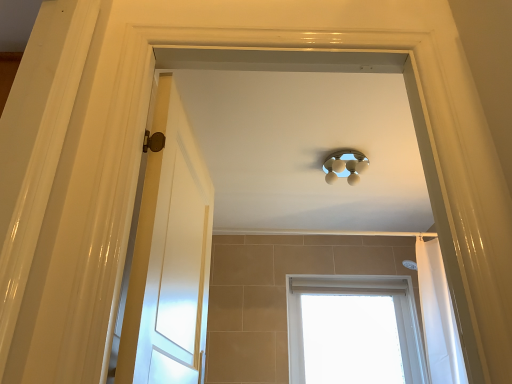
What do you see at coordinates (170, 256) in the screenshot? Image resolution: width=512 pixels, height=384 pixels. I see `white wooden door at left` at bounding box center [170, 256].

You are a GUI agent. You are given a task and a screenshot of the screen. Output one action in this format:
    pyautogui.click(x=<x>, y=<y>)
    Task: Click on the white wooden door at left
    Image resolution: width=512 pixels, height=384 pixels.
    Given the screenshot: What is the action you would take?
    pyautogui.click(x=170, y=256)

Where is `satin silver light fixture at center`? This screenshot has height=384, width=512. satin silver light fixture at center is located at coordinates (345, 165).

Identify the location of white plastic window at lower center. (357, 293).

Which is behind, point (434, 342) or point (291, 279)?

Point (291, 279)

Which of these two, white fabric shower curtain at right or white plastic window at lower center, stands taller?

With more height is white fabric shower curtain at right.

The height and width of the screenshot is (384, 512). Identify the location of shower curtain above the white plastic window at lower center (from a real-world perspective). (438, 316).

Between white fabric shower curtain at right and white plastic window at lower center, which one has smaller size?

Smaller between the two is white fabric shower curtain at right.

Between white fabric shower curtain at right and white wooden door at left, which one has larger size?

Bigger between the two is white fabric shower curtain at right.

Can you confirm if white fabric shower curtain at right is shorter than white wooden door at left?

In fact, white fabric shower curtain at right may be taller than white wooden door at left.

From the image's perspective, is white fabric shower curtain at right located above white wooden door at left?

No.

Locate an element on the screen. This screenshot has height=384, width=512. door that appears in front of the white fabric shower curtain at right is located at coordinates (170, 256).

Considering their positions, is white plastic window at lower center located in front of or behind satin silver light fixture at center?

Visually, white plastic window at lower center is located behind satin silver light fixture at center.

Is white plastic window at lower center positioned with its back to satin silver light fixture at center?

white plastic window at lower center does not have its back to satin silver light fixture at center.

In the scene shown: Is white plastic window at lower center completely or partially outside of satin silver light fixture at center?

white plastic window at lower center lies outside satin silver light fixture at center's area.

From a real-world perspective, is white plastic window at lower center physically above satin silver light fixture at center?

No, from a real-world perspective, white plastic window at lower center is not on top of satin silver light fixture at center.

Is satin silver light fixture at center wider than white wooden door at left?

Yes, satin silver light fixture at center is wider than white wooden door at left.

Between point (336, 159) and point (191, 199), which one is positioned in front?

The point (191, 199) is in front.

Is satin silver light fixture at center inside or outside of white wooden door at left?

The correct answer is: outside.

How many degrees apart are the facing directions of white wooden door at left and satin silver light fixture at center?

The angle between the facing direction of white wooden door at left and the facing direction of satin silver light fixture at center is 84.9 degrees.

Is white wooden door at left facing towards satin silver light fixture at center?

No.

From a real-world perspective, which object rests below the other?

white wooden door at left is physically lower.

Which is behind, point (189, 258) or point (344, 173)?

The point (344, 173) is behind.

From the picture: Is satin silver light fixture at center oriented towards white plastic window at lower center?

No, satin silver light fixture at center is not turned towards white plastic window at lower center.

Which object is positioned more to the left, satin silver light fixture at center or white plastic window at lower center?

Positioned to the left is satin silver light fixture at center.

From a real-world perspective, who is located higher, satin silver light fixture at center or white plastic window at lower center?

From a 3D spatial view, satin silver light fixture at center is above.

Is point (364, 170) behind point (433, 378)?

Yes, it is behind point (433, 378).

Does satin silver light fixture at center have a lesser height compared to white fabric shower curtain at right?

Yes.

From the image's perspective, is satin silver light fixture at center above or below white fabric shower curtain at right?

Based on their image positions, satin silver light fixture at center is located above white fabric shower curtain at right.

I want to click on window on the left of white fabric shower curtain at right, so click(357, 293).

Where is `shower curtain on the right of the white wooden door at left`? The height and width of the screenshot is (384, 512). shower curtain on the right of the white wooden door at left is located at coordinates (438, 316).

From the image, which object appears to be nearer to white wooden door at left, white plastic window at lower center or white fabric shower curtain at right?

The object closer to white wooden door at left is white fabric shower curtain at right.

Estimate the real-world distances between objects in this image. Which object is further from white fabric shower curtain at right, white wooden door at left or white plastic window at lower center?

white wooden door at left.

Considering their positions, is white fabric shower curtain at right positioned closer to satin silver light fixture at center than white plastic window at lower center?

white fabric shower curtain at right is closer to satin silver light fixture at center.

From the image, which object appears to be nearer to satin silver light fixture at center, white plastic window at lower center or white fabric shower curtain at right?

white fabric shower curtain at right is positioned closer to the anchor satin silver light fixture at center.

Based on their spatial positions, is white wooden door at left or satin silver light fixture at center closer to white plastic window at lower center?

→ satin silver light fixture at center is positioned closer to the anchor white plastic window at lower center.

Based on their spatial positions, is satin silver light fixture at center or white wooden door at left further from white plastic window at lower center?

Based on the image, white wooden door at left appears to be further to white plastic window at lower center.

Based on their spatial positions, is satin silver light fixture at center or white plastic window at lower center closer to white fabric shower curtain at right?

Based on the image, white plastic window at lower center appears to be nearer to white fabric shower curtain at right.

In the scene shown: Considering their positions, is satin silver light fixture at center positioned closer to white wooden door at left than white plastic window at lower center?

Among the two, satin silver light fixture at center is located nearer to white wooden door at left.

Locate an element on the screen. The image size is (512, 384). shower curtain between white wooden door at left and satin silver light fixture at center from front to back is located at coordinates (438, 316).

Locate an element on the screen. shower curtain located between white wooden door at left and white plastic window at lower center in the depth direction is located at coordinates (438, 316).

Image resolution: width=512 pixels, height=384 pixels. In order to click on lamp between white wooden door at left and white plastic window at lower center from front to back in this screenshot , I will do `click(345, 165)`.

Image resolution: width=512 pixels, height=384 pixels. I want to click on shower curtain between satin silver light fixture at center and white plastic window at lower center vertically, so click(438, 316).